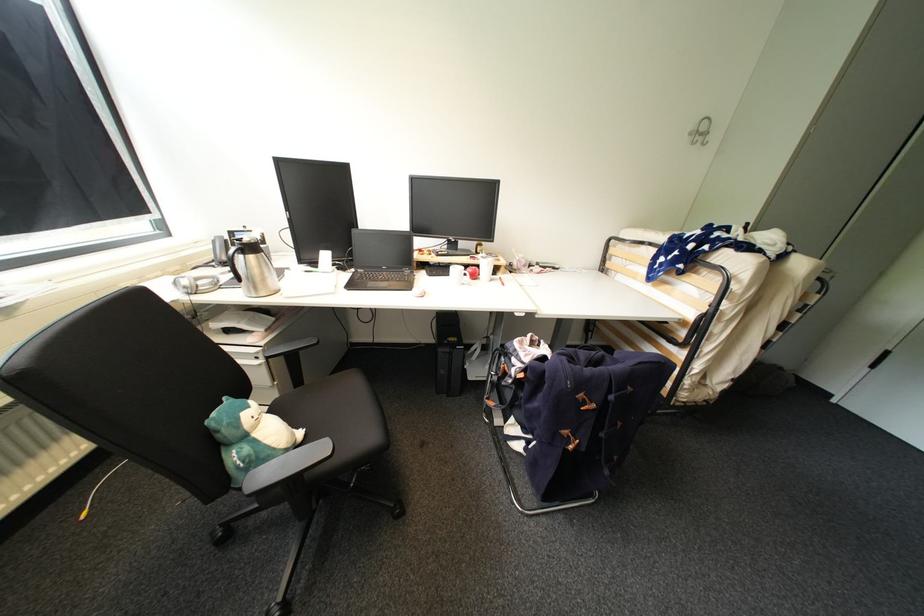
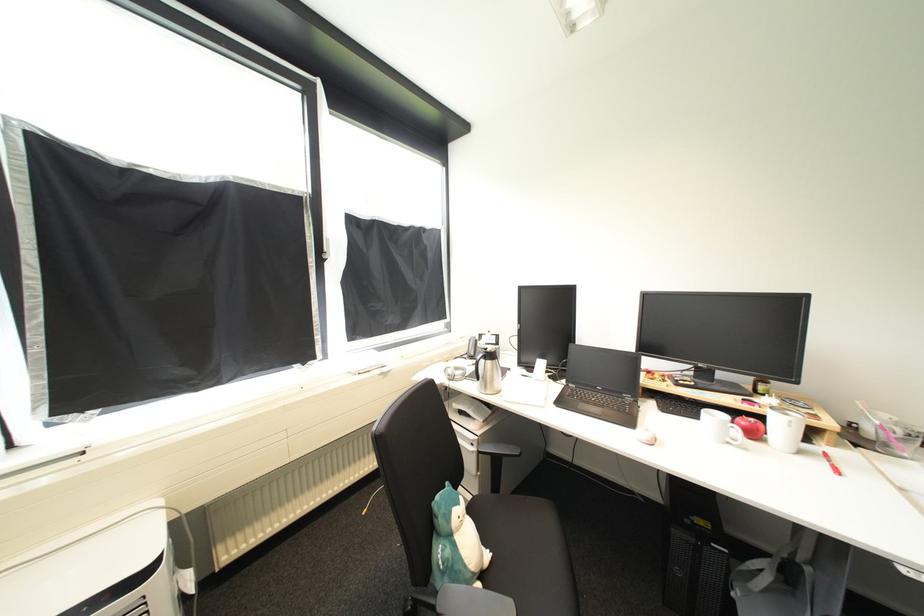
The point at (266, 365) is marked in the first image. Where is the corresponding point in the second image?

(480, 453)